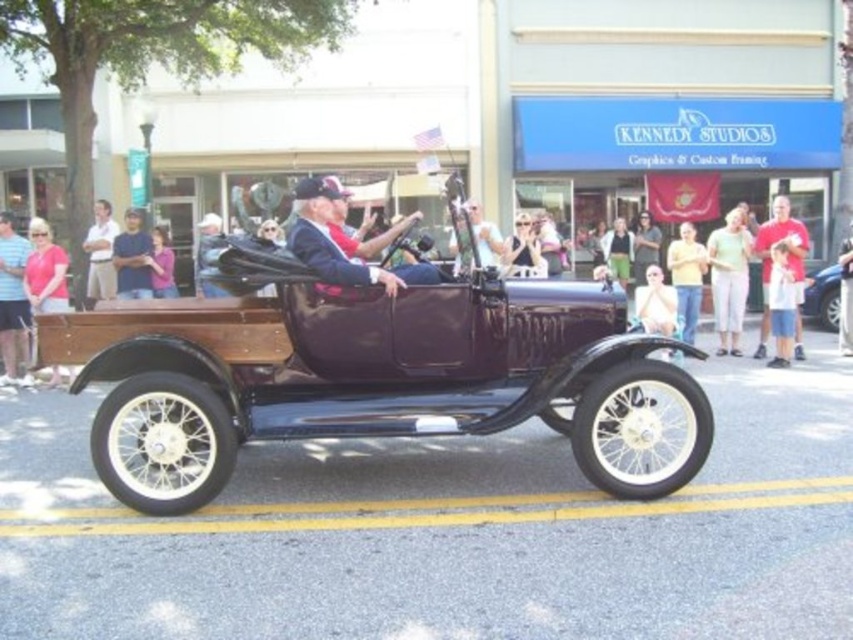
You are a photographer standing at the edge of the parade route. You want to capture the shiny blue car at center in your shot. Based on its position, where should you aim your camera to ensure it is centered in the frame?

To center the shiny blue car at center in your frame, aim your camera at the coordinates point (x=822, y=298), as that is the 2D location of the shiny blue car at center.

You are a photographer at the vintage car parade. You want to capture a photo of the driver and passenger wearing the light yellow fabric pants at right and the red cotton shirt at right. Based on their positions, which one is positioned more to the left side of the car?

The light yellow fabric pants at right are positioned more to the left side of the car compared to the red cotton shirt at right.

In the scene shown: You are a photographer at the vintage car parade. You have a matte black camera at center and want to take a photo of the shiny blue car at center. Considering the height difference between them, will you need to adjust your camera angle upwards or downwards to frame the car properly?

The shiny blue car at center is taller than the matte black camera at center, so you will need to adjust your camera angle upwards to frame the car properly.